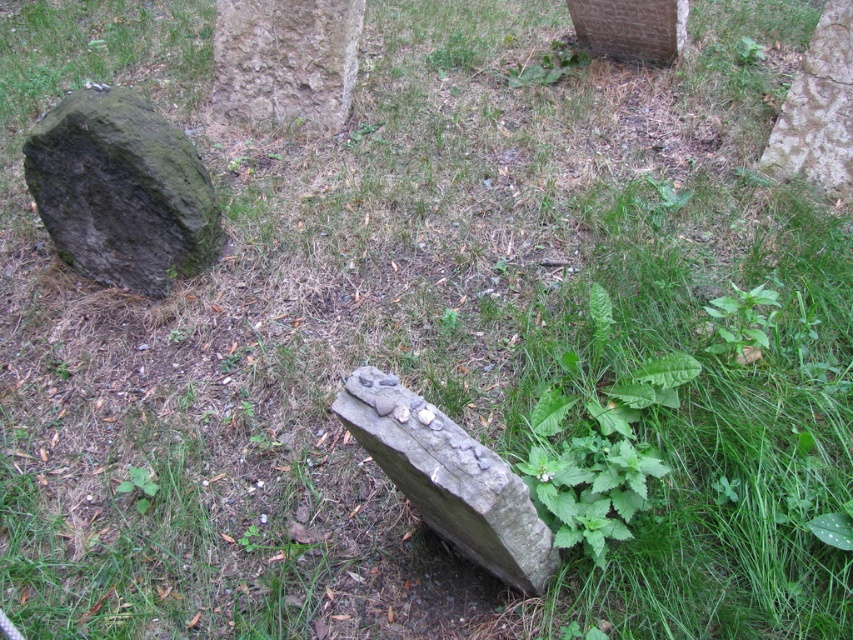
Can you confirm if gray rough stone at center is thinner than smooth gray stone at upper center?

Yes, gray rough stone at center is thinner than smooth gray stone at upper center.

Can you confirm if gray rough stone at center is bigger than smooth gray stone at upper center?

Indeed, gray rough stone at center has a larger size compared to smooth gray stone at upper center.

You are a GUI agent. You are given a task and a screenshot of the screen. Output one action in this format:
    pyautogui.click(x=<x>, y=<y>)
    Task: Click on the gray rough stone at center
    Image resolution: width=853 pixels, height=640 pixels.
    Given the screenshot: What is the action you would take?
    pyautogui.click(x=450, y=477)

Who is more distant from viewer, (42, 122) or (370, 388)?

Point (42, 122)

Is green mossy stone at left to the right of gray rough stone at center from the viewer's perspective?

Incorrect, green mossy stone at left is not on the right side of gray rough stone at center.

Which is in front, point (100, 264) or point (364, 365)?

Point (364, 365) is in front.

Locate an element on the screen. The width and height of the screenshot is (853, 640). green mossy stone at left is located at coordinates (120, 189).

Does gray rough stone at center lie in front of rough textured stone at upper center?

Yes, gray rough stone at center is in front of rough textured stone at upper center.

Can you confirm if gray rough stone at center is positioned to the left of rough textured stone at upper center?

No, gray rough stone at center is not to the left of rough textured stone at upper center.

You are a GUI agent. You are given a task and a screenshot of the screen. Output one action in this format:
    pyautogui.click(x=<x>, y=<y>)
    Task: Click on the gray rough stone at center
    The image size is (853, 640).
    Given the screenshot: What is the action you would take?
    pyautogui.click(x=450, y=477)

In order to click on gray rough stone at center in this screenshot , I will do point(450,477).